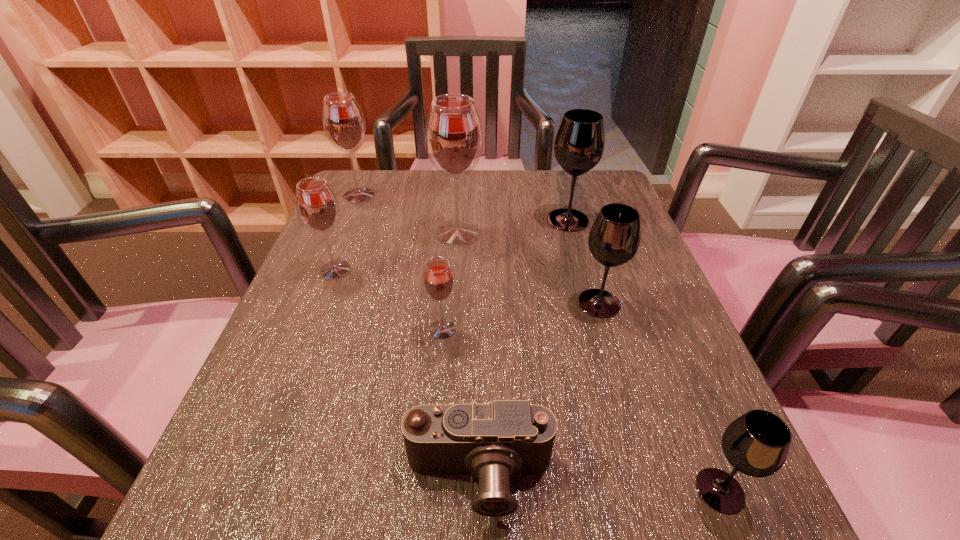
Identify the location of vacant area that lies between the camera and the smallest red wineglass. This screenshot has height=540, width=960. (461, 404).

This screenshot has height=540, width=960. In order to click on free space between the fourth farthest object and the second farthest gray wineglass in this screenshot , I will do `click(467, 286)`.

Where is `free spot between the second farthest gray wineglass and the fourth farthest wineglass`? The image size is (960, 540). free spot between the second farthest gray wineglass and the fourth farthest wineglass is located at coordinates (467, 286).

You are a GUI agent. You are given a task and a screenshot of the screen. Output one action in this format:
    pyautogui.click(x=<x>, y=<y>)
    Task: Click on the empty space that is in between the second nearest red wineglass and the shortest object
    This screenshot has height=540, width=960.
    Given the screenshot: What is the action you would take?
    pyautogui.click(x=407, y=374)

This screenshot has height=540, width=960. In order to click on vacant space in between the smallest gray wineglass and the farthest wineglass in this screenshot , I will do `click(540, 343)`.

You are a GUI agent. You are given a task and a screenshot of the screen. Output one action in this format:
    pyautogui.click(x=<x>, y=<y>)
    Task: Click on the free space that is in between the smallest red wineglass and the fourth farthest object
    The image size is (960, 540).
    Given the screenshot: What is the action you would take?
    pyautogui.click(x=389, y=300)

The height and width of the screenshot is (540, 960). In order to click on unoccupied position between the nearest red wineglass and the second farthest gray wineglass in this screenshot , I will do click(x=520, y=316).

The width and height of the screenshot is (960, 540). I want to click on empty location between the second farthest gray wineglass and the fourth farthest wineglass, so click(467, 286).

I want to click on free space that is in between the smallest red wineglass and the farthest wineglass, so click(400, 262).

Where is `the seventh closest object relative to the nearest red wineglass`? The width and height of the screenshot is (960, 540). the seventh closest object relative to the nearest red wineglass is located at coordinates (343, 121).